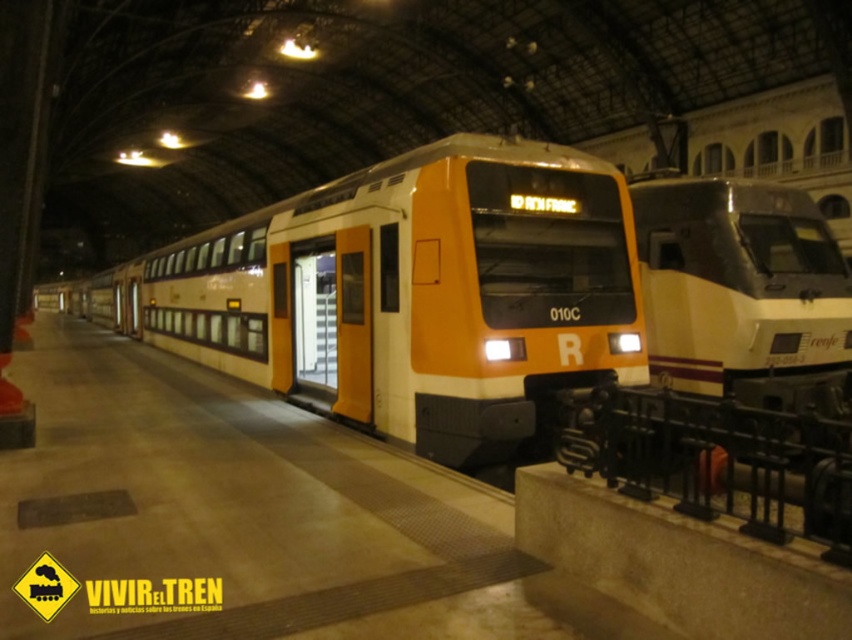
Who is taller, matte yellow train at center or black wrought iron rail at lower right?

matte yellow train at center is taller.

Is matte yellow train at center shorter than black wrought iron rail at lower right?

No, matte yellow train at center is not shorter than black wrought iron rail at lower right.

What do you see at coordinates (743, 292) in the screenshot? This screenshot has height=640, width=852. I see `matte yellow train at center` at bounding box center [743, 292].

You are a GUI agent. You are given a task and a screenshot of the screen. Output one action in this format:
    pyautogui.click(x=<x>, y=<y>)
    Task: Click on the matte yellow train at center
    The height and width of the screenshot is (640, 852).
    Given the screenshot: What is the action you would take?
    pyautogui.click(x=743, y=292)

Consider the image. Does matte orange train at center have a lesser height compared to matte yellow train at center?

Yes, matte orange train at center is shorter than matte yellow train at center.

Is matte orange train at center bigger than matte yellow train at center?

Correct, matte orange train at center is larger in size than matte yellow train at center.

Does point (390, 266) come behind point (757, 404)?

No, (390, 266) is in front of (757, 404).

At what (x,y) coordinates should I click in order to perform the action: click on matte orange train at center. Please return your answer as a coordinate pair (x, y). The height and width of the screenshot is (640, 852). Looking at the image, I should click on (410, 292).

Does matte orange train at center have a lesser height compared to black wrought iron rail at lower right?

No.

Measure the distance between matte orange train at center and black wrought iron rail at lower right.

matte orange train at center is 13.65 meters away from black wrought iron rail at lower right.

What do you see at coordinates (410, 292) in the screenshot? I see `matte orange train at center` at bounding box center [410, 292].

Find the location of `matte orange train at center`. matte orange train at center is located at coordinates (410, 292).